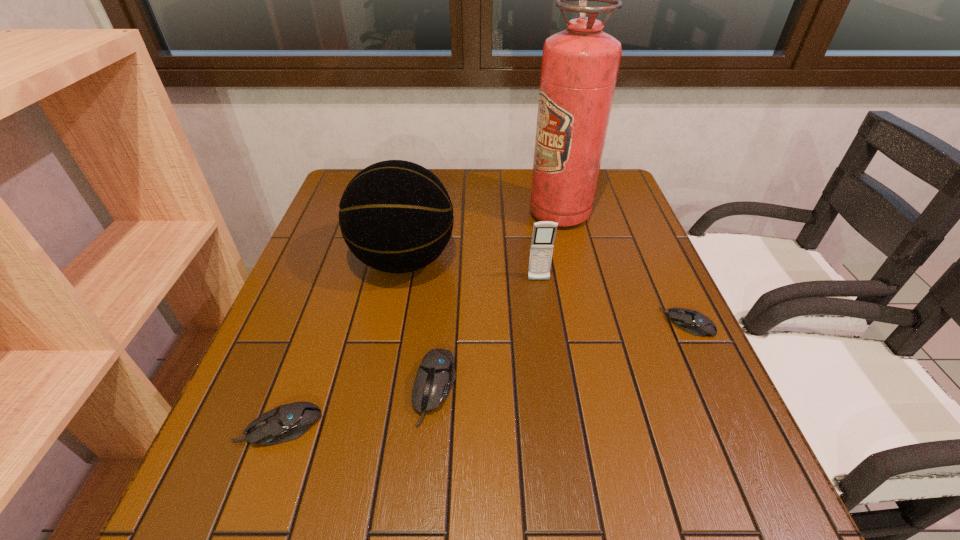
Where is `fire extinguisher that is at the right edge`? The width and height of the screenshot is (960, 540). fire extinguisher that is at the right edge is located at coordinates (580, 65).

Locate an element on the screen. The width and height of the screenshot is (960, 540). object that is at the near left corner is located at coordinates (286, 422).

The width and height of the screenshot is (960, 540). In order to click on object present at the far right corner in this screenshot , I will do `click(580, 65)`.

In the image, there is a desktop. At what (x,y) coordinates should I click in order to perform the action: click on vacant space at the far edge. Please return your answer as a coordinate pair (x, y). The width and height of the screenshot is (960, 540). Looking at the image, I should click on (491, 181).

What are the coordinates of `vacant region at the near edge` in the screenshot? It's located at (379, 436).

Locate an element on the screen. vacant space at the left edge of the desktop is located at coordinates (328, 226).

Locate an element on the screen. The height and width of the screenshot is (540, 960). free space at the right edge is located at coordinates (622, 332).

Where is `vacant point at the far right corner`? vacant point at the far right corner is located at coordinates (597, 202).

This screenshot has width=960, height=540. Identify the location of vacant space at the near right corner. (721, 453).

What are the coordinates of `vacant space that is in between the cellular telephone and the second computer mouse from left to right` in the screenshot? It's located at (487, 334).